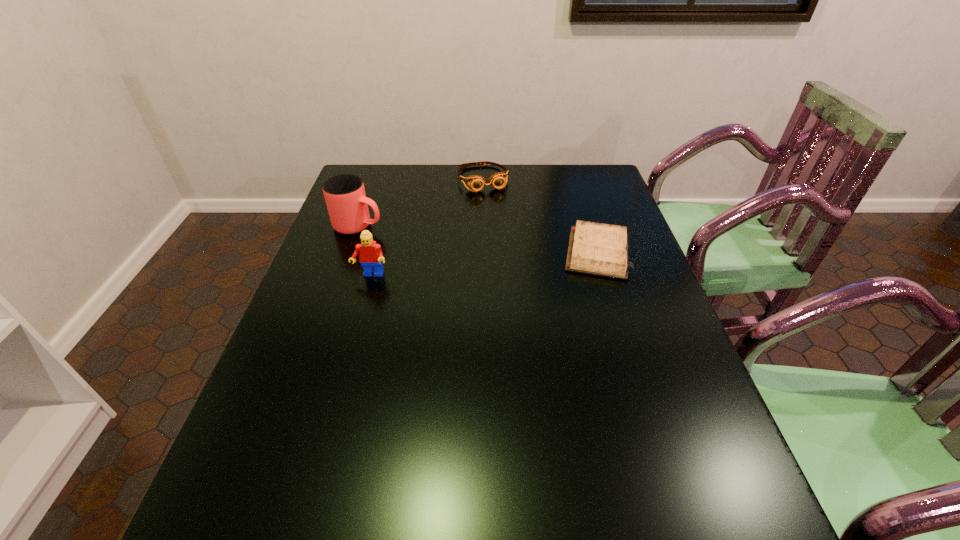
I want to click on Lego, so click(370, 254).

Where is `the rightmost object`? The height and width of the screenshot is (540, 960). the rightmost object is located at coordinates (598, 249).

The height and width of the screenshot is (540, 960). In order to click on the shortest object in this screenshot , I will do `click(598, 249)`.

What are the coordinates of `the third object from left to right` in the screenshot? It's located at (498, 180).

Locate an element on the screen. the second shortest object is located at coordinates (498, 180).

Image resolution: width=960 pixels, height=540 pixels. In order to click on cup in this screenshot , I will do `click(347, 204)`.

The width and height of the screenshot is (960, 540). What are the coordinates of `free location located on the front-facing side of the Lego` in the screenshot? It's located at 332,417.

Identify the location of free spot located 0.380m on the left of the shortest object. (428, 252).

Identify the location of vacant area located 0.300m with the lenses facing forward on the second object from right to left. (512, 247).

Identify the location of vacant space located with the lenses facing forward on the second object from right to left. (495, 208).